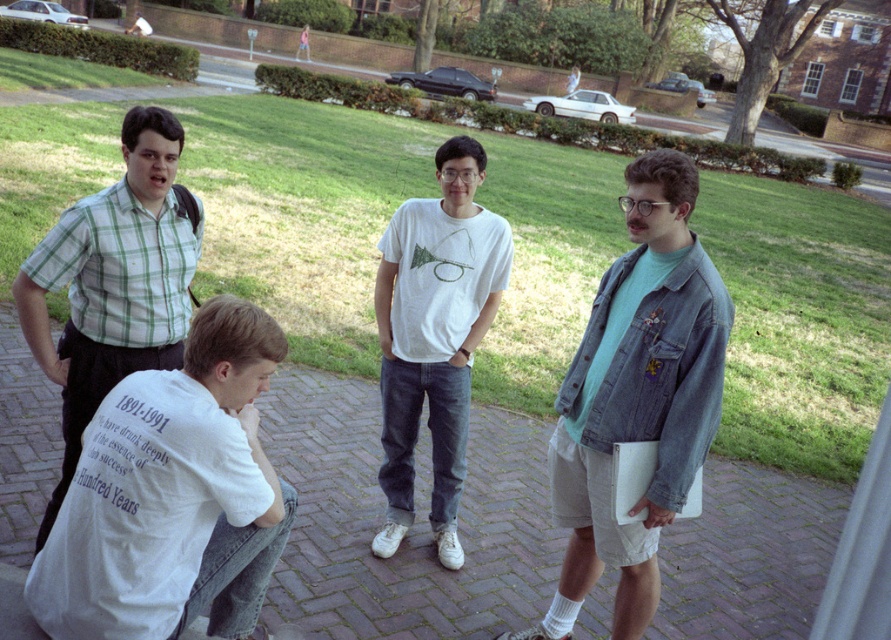
You are standing on the brick pavement at center and want to walk to the denim jacket at right. Which direction should you face to move towards it?

The brick pavement at center is to the left of denim jacket at right, so you should face to the right to move towards the denim jacket at right.